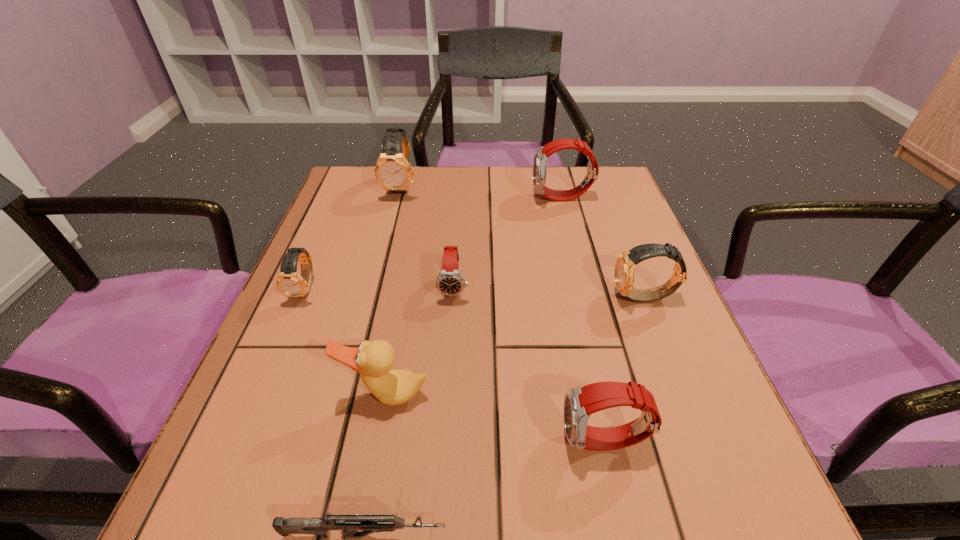
Identify the location of the biggest gold watch. The width and height of the screenshot is (960, 540). 393,171.

In order to click on the second watch from left to right in this screenshot , I will do `click(393, 171)`.

Locate an element on the screen. This screenshot has width=960, height=540. the farthest red watch is located at coordinates (540, 158).

At what (x,y) coordinates should I click in order to perform the action: click on the rightmost gold watch. Please return your answer as a coordinate pair (x, y). Looking at the image, I should click on (625, 265).

Locate an element on the screen. The height and width of the screenshot is (540, 960). the seventh farthest object is located at coordinates (580, 402).

This screenshot has width=960, height=540. I want to click on the nearest watch, so click(580, 402).

Identify the location of duck. [374, 360].

Find the location of a particular element. This screenshot has height=540, width=960. the third nearest object is located at coordinates (374, 360).

Locate an element on the screen. The width and height of the screenshot is (960, 540). the smallest gold watch is located at coordinates (289, 282).

Where is `the leftmost object`? This screenshot has width=960, height=540. the leftmost object is located at coordinates [x=289, y=282].